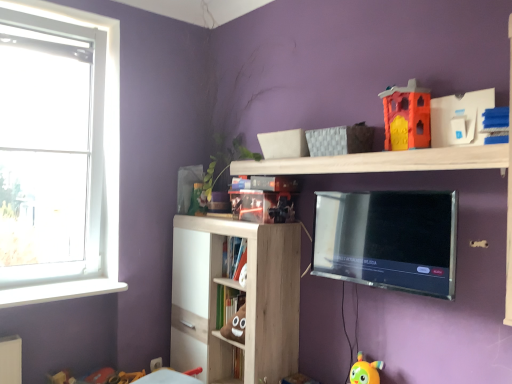
Question: From a real-world perspective, is wooden shelf at upper center, the 1th shelf when ordered from top to bottom, above or below hardcover book at center, the 2th book from the bottom?

Choices:
 (A) above
 (B) below

Answer: (A)

Question: Considering the positions of wooden shelf at upper center, the 1th shelf when ordered from top to bottom, and hardcover book at center, the second book in the top-to-bottom sequence, in the image, is wooden shelf at upper center, the 1th shelf when ordered from top to bottom, taller or shorter than hardcover book at center, the second book in the top-to-bottom sequence,?

Choices:
 (A) short
 (B) tall

Answer: (A)

Question: Based on their relative distances, which object is nearer to the hardcover book at center, the 2th book from the bottom?

Choices:
 (A) orange matte plastic castle at upper right, the second toy from the bottom
 (B) wooden shelf at upper center, placed as the second shelf when sorted from bottom to top
 (C) glossy plastic bookshelf at upper center, which is the first book in top-to-bottom order
 (D) white matte bookshelf at center, which ranks as the 3th book in top-to-bottom order
 (E) white plastic window at left

Answer: (D)

Question: Which object is positioned farthest from the white plastic window at left?

Choices:
 (A) satin black tv at upper center
 (B) glossy plastic bookshelf at upper center, which is the first book in top-to-bottom order
 (C) wooden shelf at upper center, placed as the second shelf when sorted from bottom to top
 (D) white glossy window sill at lower left
 (E) orange matte plastic castle at upper right, the second toy from the bottom

Answer: (E)